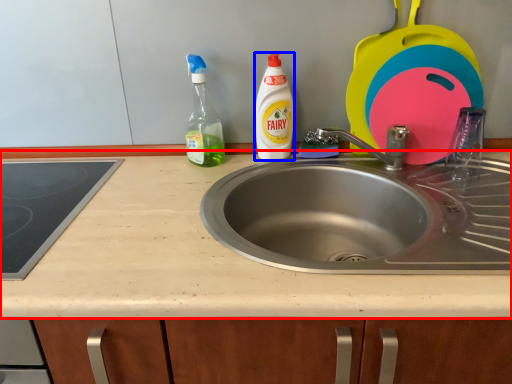
Question: Which of the following is the closest to the observer, countertop (highlighted by a red box) or cleaning product (highlighted by a blue box)?

Choices:
 (A) countertop
 (B) cleaning product

Answer: (A)